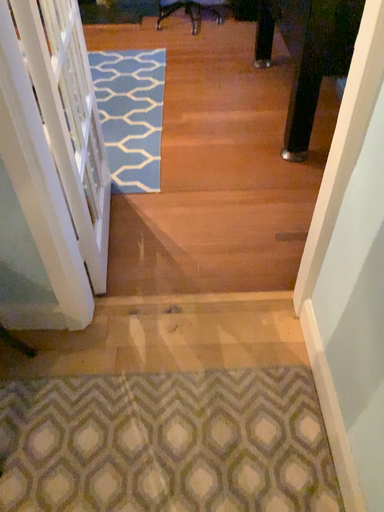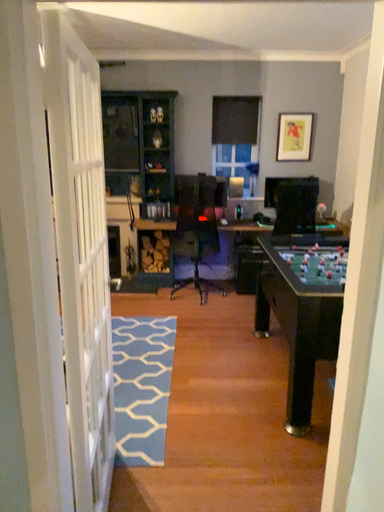
Question: Which way did the camera rotate in the video?

Choices:
 (A) rotated downward
 (B) rotated upward

Answer: (B)